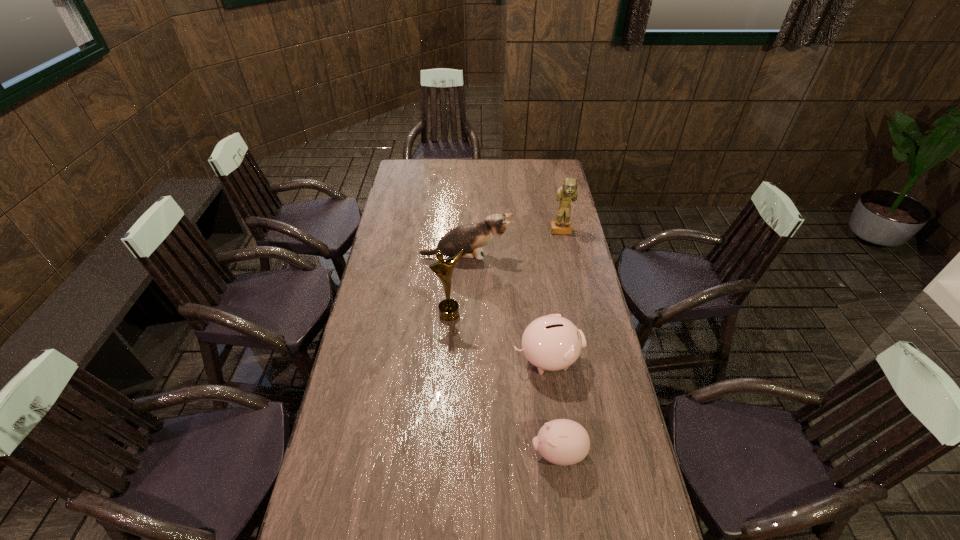
Find the location of a particular element. award is located at coordinates (448, 308).

This screenshot has height=540, width=960. Find the location of `figurine`. figurine is located at coordinates (568, 191).

Where is `cat`? Image resolution: width=960 pixels, height=540 pixels. cat is located at coordinates (471, 237).

Image resolution: width=960 pixels, height=540 pixels. In order to click on the third tallest object in this screenshot , I will do `click(471, 237)`.

At what (x,y) coordinates should I click in order to perform the action: click on the farther piggy bank. Please return your answer as a coordinate pair (x, y). The image size is (960, 540). Looking at the image, I should click on (552, 343).

You are a GUI agent. You are given a task and a screenshot of the screen. Output one action in this format:
    pyautogui.click(x=<x>, y=<y>)
    Task: Click on the fourth farthest object
    
    Given the screenshot: What is the action you would take?
    pyautogui.click(x=552, y=343)

Identify the location of the nearest object. (564, 442).

This screenshot has height=540, width=960. I want to click on the shortest object, so click(564, 442).

Image resolution: width=960 pixels, height=540 pixels. In order to click on vacant space located on the front-facing side of the third nearest object in this screenshot , I will do `click(444, 397)`.

The height and width of the screenshot is (540, 960). What are the coordinates of `free space located on the front-facing side of the figurine` in the screenshot? It's located at (573, 287).